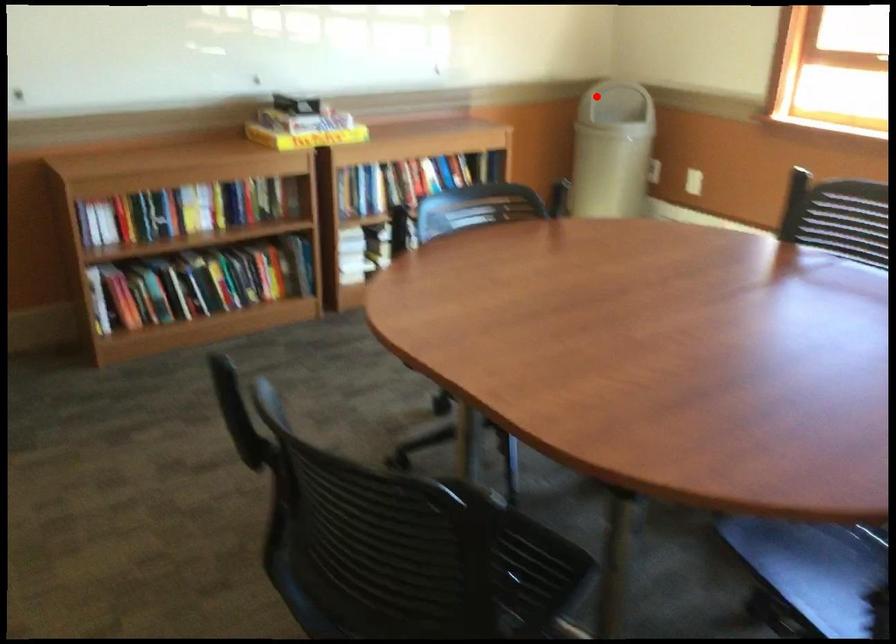
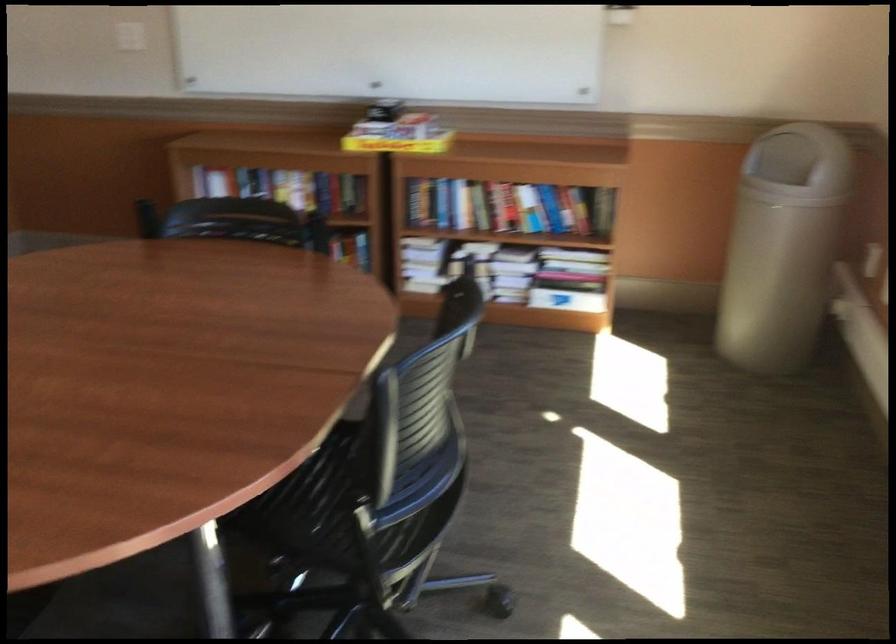
Question: I am providing you with two images of the same scene from different viewpoints. Image1 has a red point marked. In image2, the corresponding 3D location appears at what relative position? Reply with the corresponding letter.

Choices:
 (A) Closer
 (B) Farther

Answer: (A)